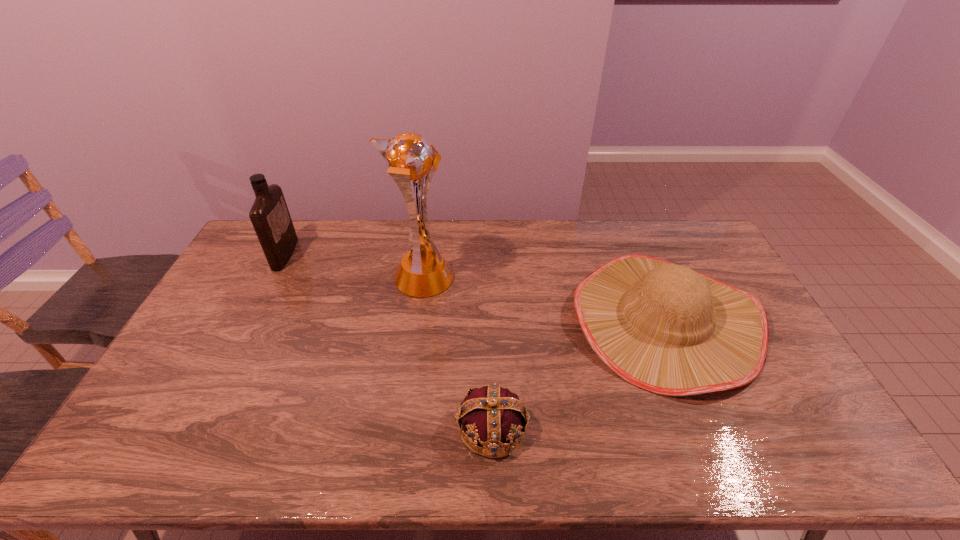
Where is `free space that satisfies the following two spatial constraints: 1. on the front-facing side of the second object from left to right; 2. on the back side of the shortest object`? free space that satisfies the following two spatial constraints: 1. on the front-facing side of the second object from left to right; 2. on the back side of the shortest object is located at coordinates (400, 428).

At what (x,y) coordinates should I click in order to perform the action: click on free spot that satisfies the following two spatial constraints: 1. on the front-facing side of the trophy; 2. on the back side of the crown. Please return your answer as a coordinate pair (x, y). Image resolution: width=960 pixels, height=540 pixels. Looking at the image, I should click on (400, 428).

Find the location of a particular element. free space that satisfies the following two spatial constraints: 1. on the label side of the third shortest object; 2. on the left side of the crown is located at coordinates (195, 428).

At what (x,y) coordinates should I click in order to perform the action: click on free space that satisfies the following two spatial constraints: 1. on the front-facing side of the second shortest object; 2. on the left side of the second object from left to right. Please return your answer as a coordinate pair (x, y). Image resolution: width=960 pixels, height=540 pixels. Looking at the image, I should click on (416, 321).

At what (x,y) coordinates should I click in order to perform the action: click on free point that satisfies the following two spatial constraints: 1. on the front-facing side of the shortest object; 2. on the left side of the third object from right to left. Please return your answer as a coordinate pair (x, y). The height and width of the screenshot is (540, 960). Looking at the image, I should click on (400, 428).

Identify the location of free space that satisfies the following two spatial constraints: 1. on the label side of the leftmost object; 2. on the right side of the rightmost object. This screenshot has width=960, height=540. (251, 321).